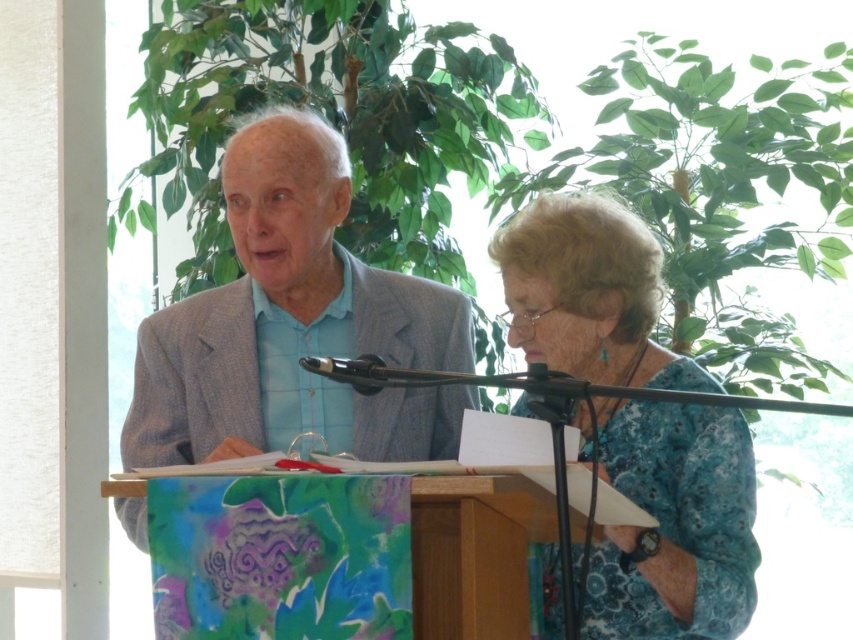
Is light blue shirt at center shorter than light gray suit at center?

Incorrect, light blue shirt at center's height does not fall short of light gray suit at center's.

Is point (434, 404) behind point (340, 268)?

No, it is not.

Who is more forward, (639,586) or (276,262)?

Point (639,586) is in front.

At what (x,y) coordinates should I click in order to perform the action: click on light blue shirt at center. Please return your answer as a coordinate pair (x, y). The image size is (853, 640). Looking at the image, I should click on (675, 524).

Who is positioned more to the right, light gray suit at center or blue floral blouse at center?

Positioned to the right is blue floral blouse at center.

Does light gray suit at center lie in front of blue floral blouse at center?

No, it is not.

Locate an element on the screen. The width and height of the screenshot is (853, 640). light gray suit at center is located at coordinates (294, 324).

Which is below, light gray suit at center or black metallic microphone at center?

black metallic microphone at center is below.

The height and width of the screenshot is (640, 853). Describe the element at coordinates (294, 324) in the screenshot. I see `light gray suit at center` at that location.

Where is `light gray suit at center`? light gray suit at center is located at coordinates (294, 324).